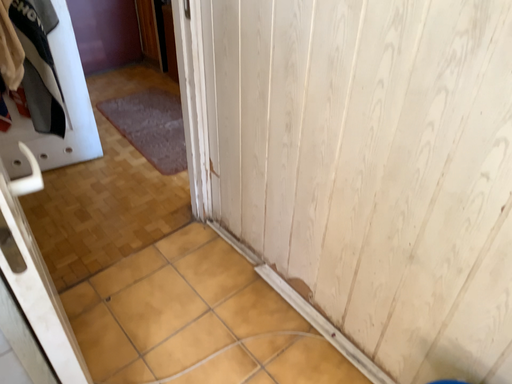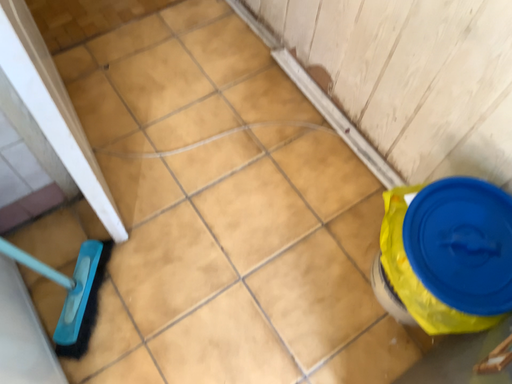
Question: How did the camera likely rotate when shooting the video?

Choices:
 (A) rotated upward
 (B) rotated downward

Answer: (B)